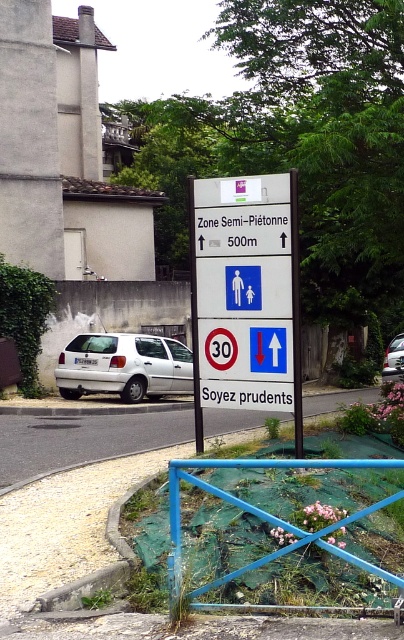
You are driving a car and need to park near the blue painted metal fence at lower center. The parking space you want is 10 meters away from the fence. Is the white matte hatchback at center blocking your parking spot?

The white matte hatchback at center is 12.22 meters from the blue painted metal fence at lower center, which means it is farther away than the 10 meters required for your parking spot. Therefore, the hatchback is not blocking your parking space.

You are standing at the signboard and want to walk towards the point that is closer to you. Which point should you head towards, point (x=298, y=420) or point (x=389, y=362)?

You should head towards point (x=298, y=420) because it is closer to the viewer than point (x=389, y=362).

You are a delivery robot navigating a semi pedestrian zone. You need to move from the starting point at point (164, 369) to the delivery point at point (294, 412). Since the zone has a speed limit of 30 kmh and requires caution, can you safely proceed directly from your current position to the delivery point without any obstacles in between?

Point (164, 369) is behind point (294, 412), so the delivery robot cannot proceed directly from point (164, 369) to point (294, 412) because the delivery point is behind the starting position relative to the robot.